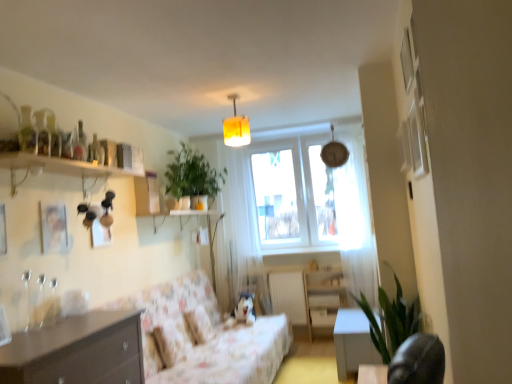
What do you see at coordinates (64, 166) in the screenshot? I see `wooden shelf at upper left` at bounding box center [64, 166].

Locate an element on the screen. The image size is (512, 384). wooden cabinet at lower right is located at coordinates (324, 297).

Where is `fluffy white pillow at center`? The image size is (512, 384). fluffy white pillow at center is located at coordinates (200, 324).

Describe the element at coordinates (240, 229) in the screenshot. I see `white sheer curtain at center, which appears as the 2th curtain when viewed from the front` at that location.

In the scene shown: Measure the distance between point (82, 321) and camera.

Point (82, 321) and camera are 2.51 meters apart.

Image resolution: width=512 pixels, height=384 pixels. I want to click on wooden shelf at upper left, so click(64, 166).

How different are the orientations of matte brown drawer at lower center and yellow fabric lampshade at upper center in degrees?

8.14 degrees.

Which is more to the right, matte brown drawer at lower center or yellow fabric lampshade at upper center?

Positioned to the right is matte brown drawer at lower center.

Is matte brown drawer at lower center looking in the opposite direction of yellow fabric lampshade at upper center?

No, matte brown drawer at lower center is not facing away from yellow fabric lampshade at upper center.

From a real-world perspective, which is physically above, matte brown drawer at lower center or yellow fabric lampshade at upper center?

yellow fabric lampshade at upper center, from a real-world perspective.

Can green leafy plant at lower right, marked as the second plant in a back-to-front arrangement, be found inside fluffy white pillow at center?

No, green leafy plant at lower right, marked as the second plant in a back-to-front arrangement, is not surrounded by fluffy white pillow at center.

From a real-world perspective, which object rests below the other?

In real-world perspective, fluffy white pillow at center is lower.

Can you confirm if fluffy white pillow at center is positioned to the left of green leafy plant at lower right, the 1th plant viewed from the right?

Correct, you'll find fluffy white pillow at center to the left of green leafy plant at lower right, the 1th plant viewed from the right.

Between point (317, 325) and point (40, 156), which one is positioned in front?

The point (40, 156) is more forward.

Is wooden shelf at upper left located within matte brown drawer at lower center?

No, wooden shelf at upper left is not surrounded by matte brown drawer at lower center.

Is matte brown drawer at lower center turned away from wooden shelf at upper left?

matte brown drawer at lower center is not turned away from wooden shelf at upper left.

Where is `shelf in front of the floral fabric couch at center`? The width and height of the screenshot is (512, 384). shelf in front of the floral fabric couch at center is located at coordinates (64, 166).

Considering the relative sizes of floral fabric couch at center and wooden shelf at upper left in the image provided, is floral fabric couch at center bigger than wooden shelf at upper left?

Yes.

Is floral fabric couch at center in front of or behind wooden shelf at upper left in the image?

floral fabric couch at center is positioned farther from the viewer than wooden shelf at upper left.

Between floral fabric couch at center and wooden shelf at upper left, which one appears on the left side from the viewer's perspective?

wooden shelf at upper left.

Looking at this image, can you confirm if green matte plant at upper center, placed as the 2th plant when sorted from front to back, is thinner than matte brown drawer at lower center?

In fact, green matte plant at upper center, placed as the 2th plant when sorted from front to back, might be wider than matte brown drawer at lower center.

How different are the orientations of green matte plant at upper center, which is the second plant from right to left, and matte brown drawer at lower center in degrees?

95 degrees separate the facing orientations of green matte plant at upper center, which is the second plant from right to left, and matte brown drawer at lower center.

Considering the relative positions of green matte plant at upper center, the first plant when ordered from top to bottom, and matte brown drawer at lower center in the image provided, is green matte plant at upper center, the first plant when ordered from top to bottom, to the right of matte brown drawer at lower center from the viewer's perspective?

→ Incorrect, green matte plant at upper center, the first plant when ordered from top to bottom, is not on the right side of matte brown drawer at lower center.

Could you tell me if green matte plant at upper center, placed as the 1th plant when sorted from back to front, is turned towards matte brown drawer at lower center?

No, green matte plant at upper center, placed as the 1th plant when sorted from back to front, is not facing towards matte brown drawer at lower center.

Considering the positions of points (244, 138) and (199, 367), is point (244, 138) farther from camera compared to point (199, 367)?

Yes, point (244, 138) is behind point (199, 367).

This screenshot has height=384, width=512. I want to click on light fixture that appears above the floral fabric couch at center (from the image's perspective), so click(236, 127).

Is yellow fabric lampshade at upper center smaller than floral fabric couch at center?

Yes, yellow fabric lampshade at upper center is smaller than floral fabric couch at center.

Based on the photo, from a real-world perspective, which is physically above, white glossy table at lower right or green matte plant at upper center, the first plant when ordered from top to bottom?

green matte plant at upper center, the first plant when ordered from top to bottom.

From the image's perspective, is white glossy table at lower right over green matte plant at upper center, the first plant when ordered from top to bottom?

No.

Which object is more forward, white glossy table at lower right or green matte plant at upper center, placed as the 2th plant when sorted from front to back?

white glossy table at lower right is more forward.

I want to click on table located underneath the green matte plant at upper center, which is the second plant from right to left (from a real-world perspective), so pos(353,342).

Where is `drawer that appears below the yellow fabric lampshade at upper center (from a real-world perspective)`? drawer that appears below the yellow fabric lampshade at upper center (from a real-world perspective) is located at coordinates (322, 317).

In order to click on plant in front of the fluffy white pillow at center in this screenshot , I will do `click(391, 319)`.

Which object lies nearer to the anchor point yellow fabric lampshade at upper center, wooden cabinet at lower right or white glossy table at lower right?

The object closer to yellow fabric lampshade at upper center is white glossy table at lower right.

Which object lies further to the anchor point yellow fabric lampshade at upper center, green leafy plant at lower right, the 1th plant viewed from the right, or white sheer curtain at center, which appears as the 2th curtain when viewed from the front?

green leafy plant at lower right, the 1th plant viewed from the right, lies further to yellow fabric lampshade at upper center than the other object.

Considering their positions, is white glossy table at lower right positioned closer to dark wood chest of drawers at lower left than wooden cabinet at lower right?

white glossy table at lower right is closer to dark wood chest of drawers at lower left.

Consider the image. Estimate the real-world distances between objects in this image. Which object is further from green leafy plant at lower right, which is the second plant from top to bottom, white glossy table at lower right or wooden cabinet at lower right?

Based on the image, wooden cabinet at lower right appears to be further to green leafy plant at lower right, which is the second plant from top to bottom.

Looking at this image, when comparing their distances from green matte plant at upper center, which is counted as the first plant, starting from the left, does floral fabric couch at center or wooden shelf at upper left seem closer?

wooden shelf at upper left lies closer to green matte plant at upper center, which is counted as the first plant, starting from the left, than the other object.

Based on their spatial positions, is fluffy white pillow at center or wooden shelf at upper left closer to green leafy plant at lower right, which is the first plant in front-to-back order?

Among the two, fluffy white pillow at center is located nearer to green leafy plant at lower right, which is the first plant in front-to-back order.

Considering their positions, is green leafy plant at lower right, the 1th plant viewed from the right, positioned closer to wooden shelf at upper left than floral fabric couch at center?

floral fabric couch at center is positioned closer to the anchor wooden shelf at upper left.

From the image, which object appears to be nearer to wooden shelf at upper left, white glossy table at lower right or matte brown drawer at lower center?

white glossy table at lower right is closer to wooden shelf at upper left.

Where is `drawer between fluffy white pillow at center and white sheer curtain at upper right, the second curtain when ordered from back to front`? drawer between fluffy white pillow at center and white sheer curtain at upper right, the second curtain when ordered from back to front is located at coordinates (322, 317).

This screenshot has width=512, height=384. What are the coordinates of `pillow positioned between green leafy plant at lower right, the second plant viewed from the left, and white sheer curtain at center, the first curtain from the left, from near to far` in the screenshot? It's located at (200, 324).

In order to click on studio couch located between wooden shelf at upper left and green leafy plant at lower right, which appears as the first plant when ordered from the bottom, in the left-right direction in this screenshot , I will do `click(212, 339)`.

I want to click on table between green leafy plant at lower right, which appears as the first plant when ordered from the bottom, and white sheer curtain at center, the 2th curtain viewed from the right, from front to back, so click(353, 342).